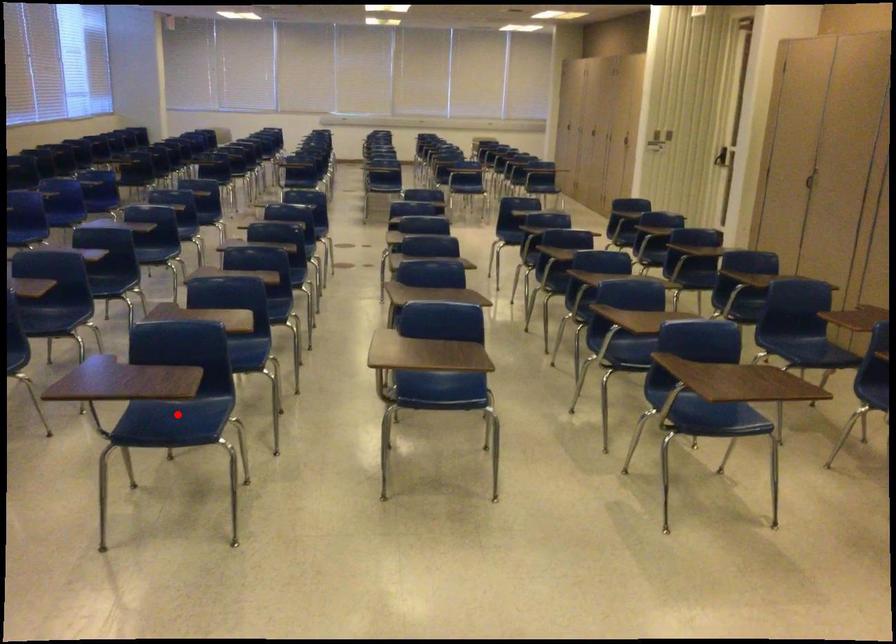
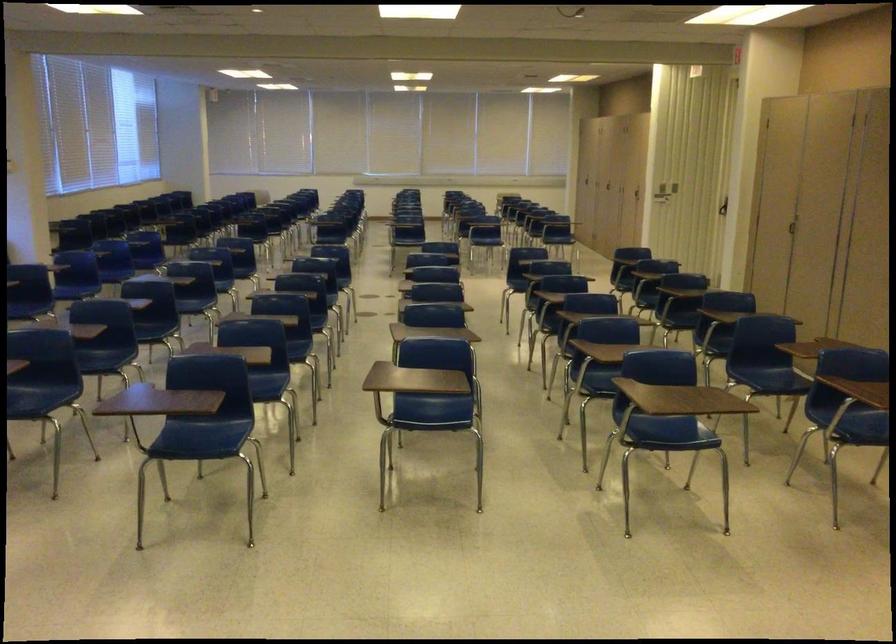
Question: I am providing you with two images of the same scene from different viewpoints. Given a red point in image1, look at the same physical point in image2. Is it:

Choices:
 (A) Closer to the viewpoint
 (B) Farther from the viewpoint

Answer: (B)